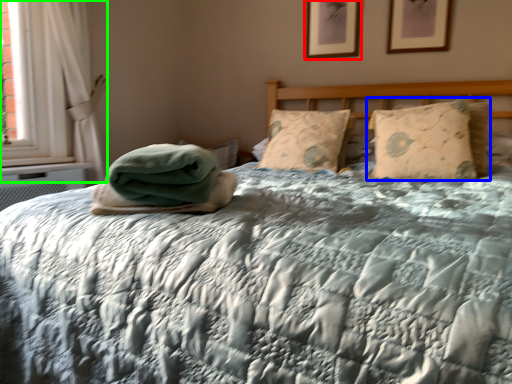
Question: Which is nearer to the picture frame (highlighted by a red box)? pillow (highlighted by a blue box) or curtain (highlighted by a green box).

Choices:
 (A) pillow
 (B) curtain

Answer: (A)